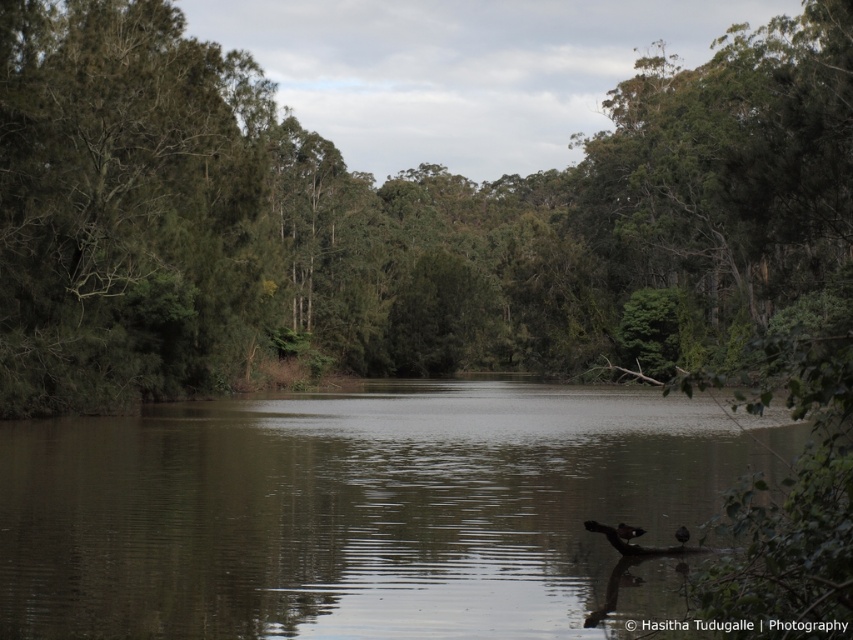
Which of these two, green leafy tree at center or greenish-brown water at center, stands taller?

green leafy tree at center

Between green leafy tree at center and greenish-brown water at center, which one is positioned higher?

green leafy tree at center is higher up.

Is point (15, 42) more distant than point (260, 461)?

That is True.

Find the location of `green leafy tree at center`. green leafy tree at center is located at coordinates tap(390, 216).